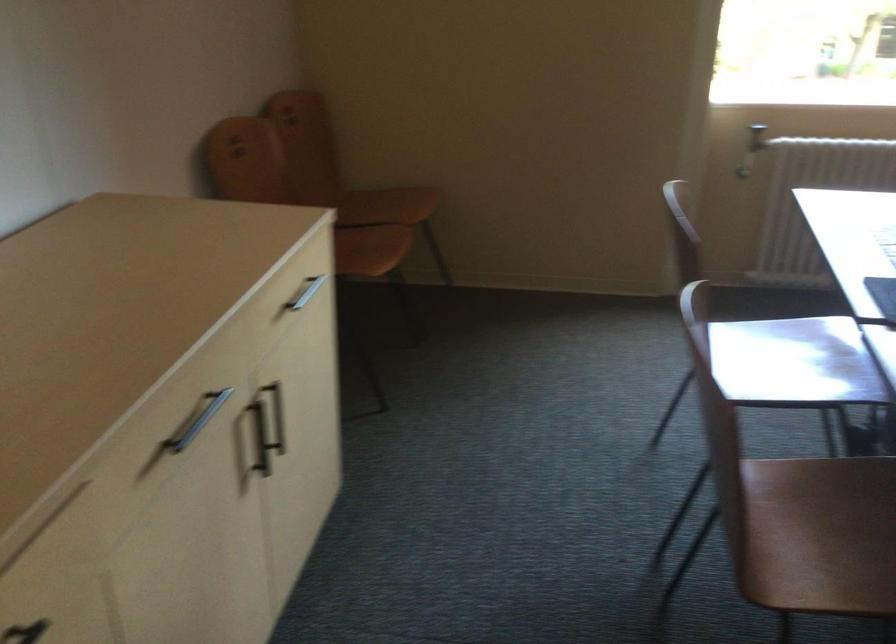
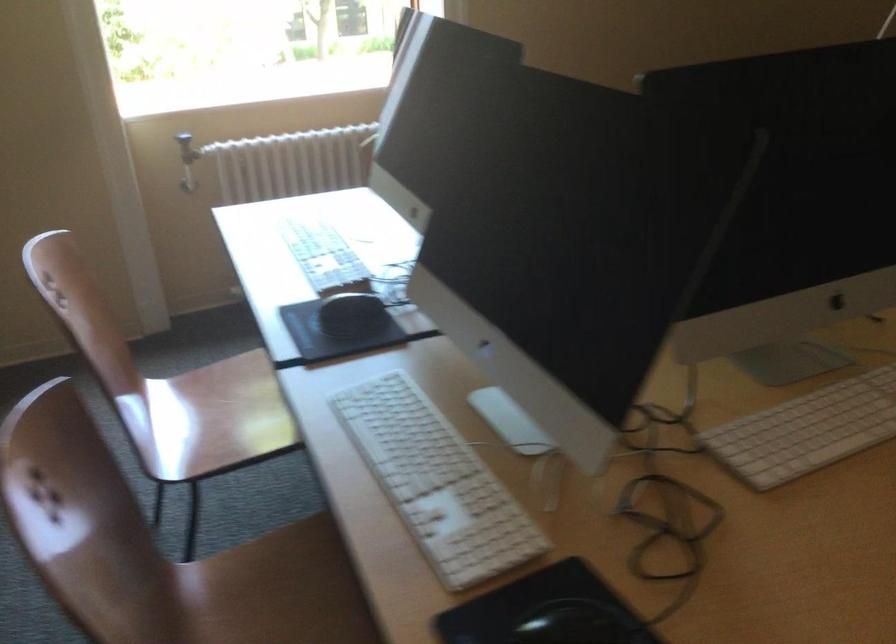
Question: Based on the continuous images, in which direction is the camera rotating? Reply with the corresponding letter.

Choices:
 (A) Left
 (B) Right
 (C) Up
 (D) Down

Answer: (B)